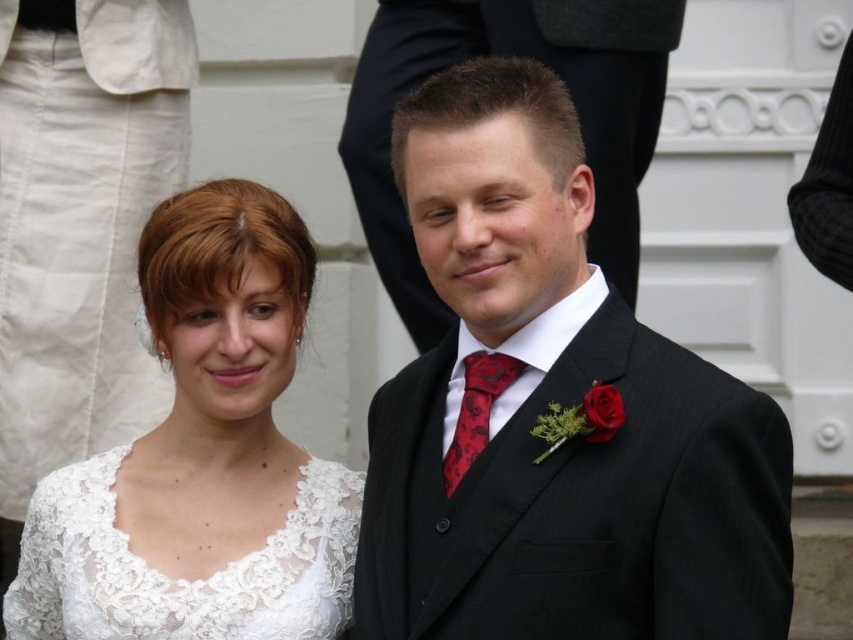
You are a photographer standing at the camera position. The couple is standing 5.81 meters away from you. You want to take a photo of the white lace dress at center. Do you think you can capture the entire dress in the frame without moving closer?

The white lace dress at center and camera are 5.81 meters apart. Whether the entire dress can be captured depends on the camera lens and sensor size. However, since the distance is fixed, you can adjust the zoom or use a wide angle lens to ensure the entire dress is in frame.

You are a photographer at a wedding venue. You need to position a spotlight on the white lace dress at center and the lace fabric dress at lower left. According to the image, which dress should be lit first if you start from the left side of the scene?

The lace fabric dress at lower left should be lit first because it is positioned to the left of the white lace dress at center.

You are a photographer at a wedding. You need to position a light source to the right of both the lace fabric dress at lower left and the red satin tie at center. Is this possible?

The lace fabric dress at lower left is to the left of the red satin tie at center, so placing the light source to the right of both is possible.